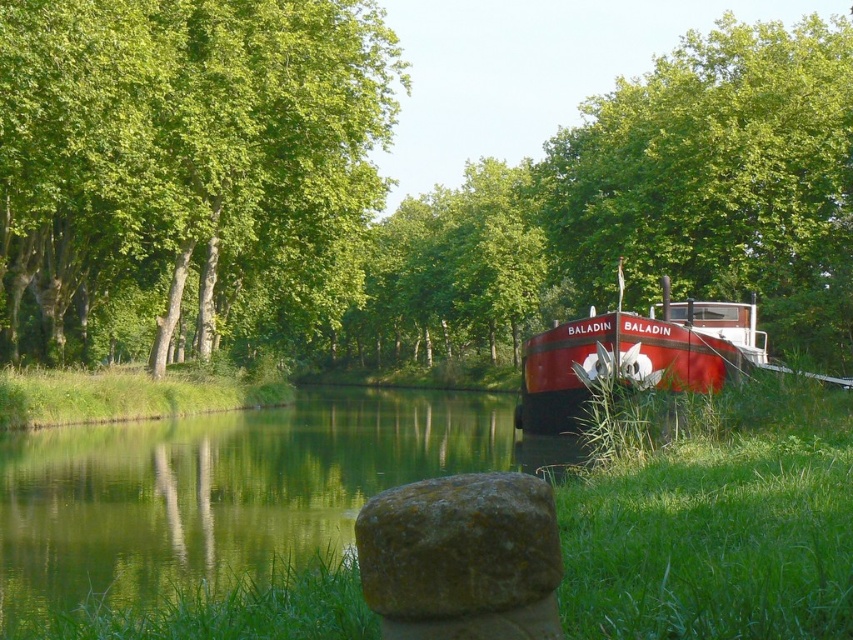
You are a gardener who needs to mow the green grass at right and move the green mossy rock at lower center to another location. Which task should you tackle first based on their current heights?

The green grass at right is much taller than the green mossy rock at lower center, so you should mow the green grass at right first before moving the green mossy rock at lower center.